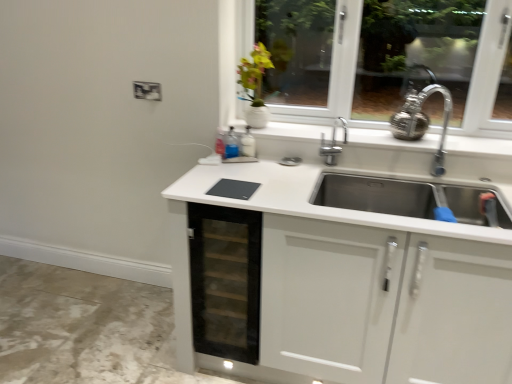
Question: Could you tell me if transparent glass drawer at center is facing green matte vase at upper center?

Choices:
 (A) no
 (B) yes

Answer: (A)

Question: Is transparent glass drawer at center bigger than green matte vase at upper center?

Choices:
 (A) yes
 (B) no

Answer: (A)

Question: Is transparent glass drawer at center wider than green matte vase at upper center?

Choices:
 (A) no
 (B) yes

Answer: (B)

Question: From a real-world perspective, is transparent glass drawer at center physically above green matte vase at upper center?

Choices:
 (A) yes
 (B) no

Answer: (B)

Question: Are transparent glass drawer at center and green matte vase at upper center located far from each other?

Choices:
 (A) yes
 (B) no

Answer: (B)

Question: Does transparent glass drawer at center contain green matte vase at upper center?

Choices:
 (A) no
 (B) yes

Answer: (A)

Question: Would you say green matte vase at upper center is a long distance from transparent glass drawer at center?

Choices:
 (A) no
 (B) yes

Answer: (A)

Question: Could you tell me if green matte vase at upper center is facing transparent glass drawer at center?

Choices:
 (A) no
 (B) yes

Answer: (A)

Question: Is green matte vase at upper center smaller than transparent glass drawer at center?

Choices:
 (A) yes
 (B) no

Answer: (A)

Question: Would you say green matte vase at upper center contains transparent glass drawer at center?

Choices:
 (A) no
 (B) yes

Answer: (A)

Question: From the image's perspective, does green matte vase at upper center appear higher than transparent glass drawer at center?

Choices:
 (A) no
 (B) yes

Answer: (B)

Question: Is green matte vase at upper center outside of transparent glass drawer at center?

Choices:
 (A) yes
 (B) no

Answer: (A)

Question: Considering their positions, is transparent glass drawer at center located in front of or behind green matte vase at upper center?

Choices:
 (A) behind
 (B) front

Answer: (B)